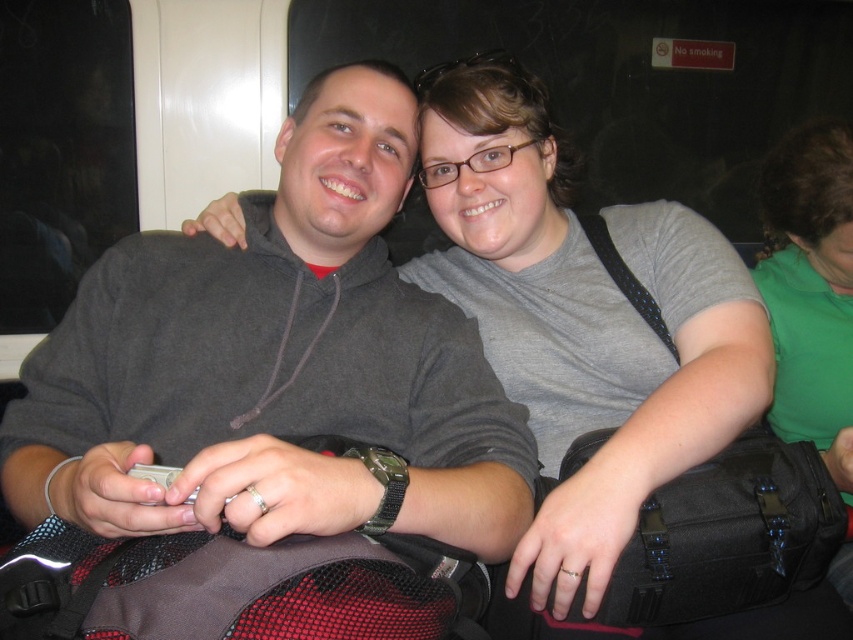
Question: Which of the following is the farthest from the observer?

Choices:
 (A) (782, 220)
 (B) (473, 536)

Answer: (A)

Question: Which object appears closest to the camera in this image?

Choices:
 (A) dark gray hoodie at center
 (B) green fabric shirt at upper right

Answer: (A)

Question: Is the position of dark gray hoodie at center less distant than that of green fabric shirt at upper right?

Choices:
 (A) no
 (B) yes

Answer: (B)

Question: Is dark gray hoodie at center above green fabric shirt at upper right?

Choices:
 (A) no
 (B) yes

Answer: (B)

Question: Can you confirm if dark gray hoodie at center is wider than green fabric shirt at upper right?

Choices:
 (A) no
 (B) yes

Answer: (B)